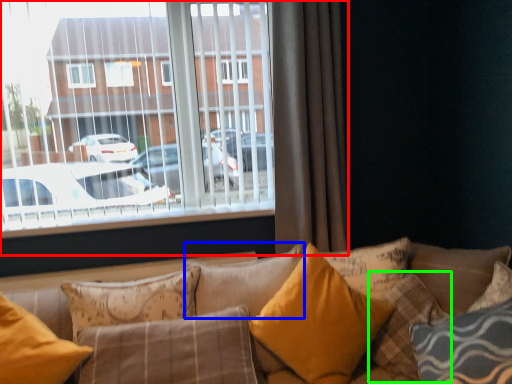
Question: Which is farther away from window (highlighted by a red box)? pillow (highlighted by a blue box) or pillow (highlighted by a green box)?

Choices:
 (A) pillow
 (B) pillow

Answer: (B)